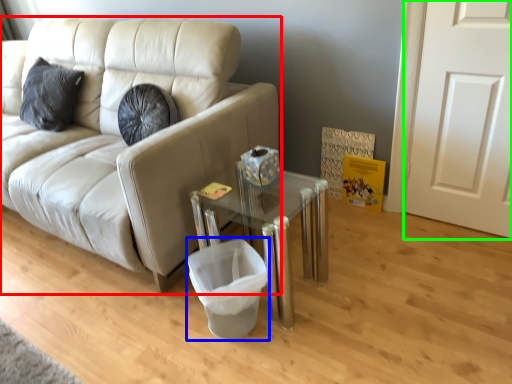
Question: Estimate the real-world distances between objects in this image. Which object is closer to studio couch (highlighted by a red box), laundry basket (highlighted by a blue box) or door (highlighted by a green box)?

Choices:
 (A) laundry basket
 (B) door

Answer: (A)